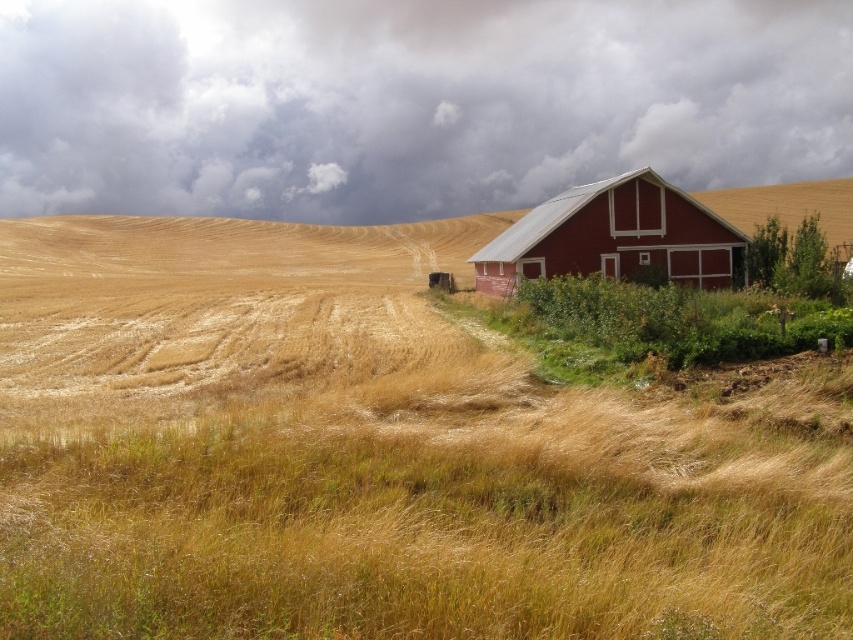
Question: Which object is positioned closest to the dry grass at lower center?

Choices:
 (A) dark gray cloud at upper center
 (B) matte red barn at right

Answer: (B)

Question: Estimate the real-world distances between objects in this image. Which object is closer to the matte red barn at right?

Choices:
 (A) dark gray cloud at upper center
 (B) dry grass at lower center

Answer: (B)

Question: Does dry grass at lower center have a larger size compared to matte red barn at right?

Choices:
 (A) yes
 (B) no

Answer: (B)

Question: Can you confirm if dry grass at lower center is bigger than matte red barn at right?

Choices:
 (A) yes
 (B) no

Answer: (B)

Question: Does dry grass at lower center come behind dark gray cloud at upper center?

Choices:
 (A) no
 (B) yes

Answer: (A)

Question: Among these objects, which one is farthest from the camera?

Choices:
 (A) dark gray cloud at upper center
 (B) dry grass at lower center
 (C) matte red barn at right

Answer: (A)